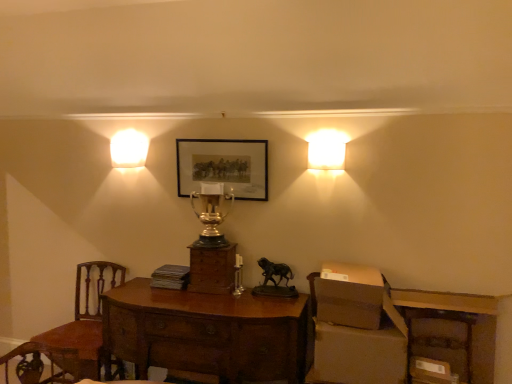
What do you see at coordinates (350, 296) in the screenshot? I see `brown cardboard box at right, which is counted as the third cardboard box, starting from the bottom` at bounding box center [350, 296].

Locate an element on the screen. The height and width of the screenshot is (384, 512). gold polished trophy at center is located at coordinates (211, 214).

The image size is (512, 384). I want to click on brown wooden desk at lower right, so coord(452,330).

This screenshot has height=384, width=512. Identify the location of matte gold trophy at upper center, placed as the 1th lamp when sorted from back to front. (129, 149).

Find the location of `desk below the brown cardboard box at lower right, which is the second cardboard box in top-to-bottom order (from the image's perspective)`. desk below the brown cardboard box at lower right, which is the second cardboard box in top-to-bottom order (from the image's perspective) is located at coordinates (206, 332).

Considering their positions, is mahogany wood desk at center located in front of or behind brown cardboard box at lower right, which is the second cardboard box in top-to-bottom order?

mahogany wood desk at center is positioned farther from the viewer than brown cardboard box at lower right, which is the second cardboard box in top-to-bottom order.

Is mahogany wood desk at center taller or shorter than brown cardboard box at lower right, placed as the 2th cardboard box when sorted from bottom to top?

Considering their sizes, mahogany wood desk at center has more height than brown cardboard box at lower right, placed as the 2th cardboard box when sorted from bottom to top.

Which of these two, mahogany wood desk at center or brown cardboard box at lower right, which is the second cardboard box in top-to-bottom order, is smaller?

brown cardboard box at lower right, which is the second cardboard box in top-to-bottom order, is smaller.

Based on their sizes in the image, would you say brown cardboard box at right, which is counted as the third cardboard box, starting from the bottom, is bigger or smaller than matte black picture frame at center?

brown cardboard box at right, which is counted as the third cardboard box, starting from the bottom, is bigger than matte black picture frame at center.

Would you say matte black picture frame at center is part of brown cardboard box at right, which is counted as the third cardboard box, starting from the bottom,'s contents?

No, matte black picture frame at center is not a part of brown cardboard box at right, which is counted as the third cardboard box, starting from the bottom.

From the picture: Considering the relative positions of brown cardboard box at right, which is counted as the third cardboard box, starting from the bottom, and matte black picture frame at center in the image provided, is brown cardboard box at right, which is counted as the third cardboard box, starting from the bottom, to the left of matte black picture frame at center from the viewer's perspective?

In fact, brown cardboard box at right, which is counted as the third cardboard box, starting from the bottom, is to the right of matte black picture frame at center.

Could you tell me if brown cardboard box at right, the 1th cardboard box when ordered from top to bottom, is facing matte black picture frame at center?

No, brown cardboard box at right, the 1th cardboard box when ordered from top to bottom, does not turn towards matte black picture frame at center.

Are brown cardboard box at lower right, placed as the 2th cardboard box when sorted from bottom to top, and gold polished trophy at center located far from each other?

That's right, there is a large distance between brown cardboard box at lower right, placed as the 2th cardboard box when sorted from bottom to top, and gold polished trophy at center.

From the image's perspective, is brown cardboard box at lower right, placed as the 2th cardboard box when sorted from bottom to top, below gold polished trophy at center?

Correct, brown cardboard box at lower right, placed as the 2th cardboard box when sorted from bottom to top, appears lower than gold polished trophy at center in the image.

Is brown cardboard box at lower right, placed as the 2th cardboard box when sorted from bottom to top, bigger than gold polished trophy at center?

Correct, brown cardboard box at lower right, placed as the 2th cardboard box when sorted from bottom to top, is larger in size than gold polished trophy at center.

Between brown cardboard box at lower right, placed as the 2th cardboard box when sorted from bottom to top, and gold polished trophy at center, which one has more height?

With more height is gold polished trophy at center.

Is brown cardboard box at lower right, acting as the first cardboard box starting from the bottom, spatially inside matte white square at upper right, marked as the 1th lamp in a right-to-left arrangement, or outside of it?

brown cardboard box at lower right, acting as the first cardboard box starting from the bottom, is spatially situated outside matte white square at upper right, marked as the 1th lamp in a right-to-left arrangement.

Considering the points (432, 365) and (324, 160), which point is in front, point (432, 365) or point (324, 160)?

Positioned in front is point (432, 365).

Is brown cardboard box at lower right, acting as the first cardboard box starting from the bottom, wider than matte white square at upper right, marked as the 1th lamp in a right-to-left arrangement?

Correct, the width of brown cardboard box at lower right, acting as the first cardboard box starting from the bottom, exceeds that of matte white square at upper right, marked as the 1th lamp in a right-to-left arrangement.

Which object is closer to the camera taking this photo, brown cardboard box at lower right, the 3th cardboard box positioned from the top, or matte white square at upper right, the 2th lamp viewed from the back?

Positioned in front is brown cardboard box at lower right, the 3th cardboard box positioned from the top.

Measure the distance from matte white square at upper right, the 1th lamp from the front, to mahogany wood chair at left.

A distance of 1.82 meters exists between matte white square at upper right, the 1th lamp from the front, and mahogany wood chair at left.

From the image's perspective, does matte white square at upper right, the 2th lamp viewed from the back, appear lower than mahogany wood chair at left?

Incorrect, from the image's perspective, matte white square at upper right, the 2th lamp viewed from the back, is higher than mahogany wood chair at left.

Based on the photo, from a real-world perspective, is matte white square at upper right, marked as the 1th lamp in a right-to-left arrangement, beneath mahogany wood chair at left?

Incorrect, from a real-world perspective, matte white square at upper right, marked as the 1th lamp in a right-to-left arrangement, is higher than mahogany wood chair at left.

Locate an element on the screen. This screenshot has width=512, height=384. chair below the matte white square at upper right, the second lamp viewed from the left (from a real-world perspective) is located at coordinates coord(87,315).

Is mahogany wood chair at left wider than brown cardboard box at lower right, acting as the first cardboard box starting from the bottom?

Correct, the width of mahogany wood chair at left exceeds that of brown cardboard box at lower right, acting as the first cardboard box starting from the bottom.

Considering the relative positions of mahogany wood chair at left and brown cardboard box at lower right, the 3th cardboard box positioned from the top, in the image provided, is mahogany wood chair at left to the right of brown cardboard box at lower right, the 3th cardboard box positioned from the top, from the viewer's perspective?

Incorrect, mahogany wood chair at left is not on the right side of brown cardboard box at lower right, the 3th cardboard box positioned from the top.

Is mahogany wood chair at left far from brown cardboard box at lower right, acting as the first cardboard box starting from the bottom?

That's right, there is a large distance between mahogany wood chair at left and brown cardboard box at lower right, acting as the first cardboard box starting from the bottom.

Can you tell me how much mahogany wood chair at left and brown cardboard box at lower right, acting as the first cardboard box starting from the bottom, differ in facing direction?

10.9 degrees.

Is brown wooden desk at lower right located within brown cardboard box at lower right, which is the second cardboard box in top-to-bottom order?

That's incorrect, brown wooden desk at lower right is not inside brown cardboard box at lower right, which is the second cardboard box in top-to-bottom order.

Which object is positioned more to the right, brown cardboard box at lower right, which is the second cardboard box in top-to-bottom order, or brown wooden desk at lower right?

From the viewer's perspective, brown wooden desk at lower right appears more on the right side.

Which is in front, brown cardboard box at lower right, placed as the 2th cardboard box when sorted from bottom to top, or brown wooden desk at lower right?

brown cardboard box at lower right, placed as the 2th cardboard box when sorted from bottom to top.

What's the angular difference between brown cardboard box at lower right, placed as the 2th cardboard box when sorted from bottom to top, and brown wooden desk at lower right's facing directions?

There is a 4.27-degree angle between the facing directions of brown cardboard box at lower right, placed as the 2th cardboard box when sorted from bottom to top, and brown wooden desk at lower right.

The height and width of the screenshot is (384, 512). In order to click on cardboard box that is the 1st one when counting forward from the mahogany wood desk at center in this screenshot , I will do pyautogui.click(x=359, y=354).

This screenshot has width=512, height=384. Find the location of `picture frame that appears behind the brown cardboard box at right, which is counted as the third cardboard box, starting from the bottom`. picture frame that appears behind the brown cardboard box at right, which is counted as the third cardboard box, starting from the bottom is located at coordinates (223, 166).

Which object lies nearer to the anchor point gold polished trophy at center, brown cardboard box at right, which is counted as the third cardboard box, starting from the bottom, or brown cardboard box at lower right, which is the second cardboard box in top-to-bottom order?

brown cardboard box at right, which is counted as the third cardboard box, starting from the bottom, is positioned closer to the anchor gold polished trophy at center.

From the image, which object appears to be farther from matte gold trophy at upper center, placed as the 2th lamp when sorted from front to back, gold polished trophy at center or brown cardboard box at right, which is counted as the third cardboard box, starting from the bottom?

brown cardboard box at right, which is counted as the third cardboard box, starting from the bottom, is positioned further to the anchor matte gold trophy at upper center, placed as the 2th lamp when sorted from front to back.

When comparing their distances from brown cardboard box at lower right, which is the second cardboard box in top-to-bottom order, does mahogany wood desk at center or matte black picture frame at center seem closer?

mahogany wood desk at center is closer to brown cardboard box at lower right, which is the second cardboard box in top-to-bottom order.

When comparing their distances from gold polished trophy at center, does matte white square at upper right, the second lamp viewed from the left, or matte gold trophy at upper center, placed as the 1th lamp when sorted from back to front, seem further?

Among the two, matte white square at upper right, the second lamp viewed from the left, is located further to gold polished trophy at center.

When comparing their distances from brown cardboard box at lower right, which is the second cardboard box in top-to-bottom order, does matte black picture frame at center or gold polished trophy at center seem closer?

Among the two, gold polished trophy at center is located nearer to brown cardboard box at lower right, which is the second cardboard box in top-to-bottom order.

When comparing their distances from matte white square at upper right, the second lamp viewed from the left, does brown cardboard box at lower right, acting as the first cardboard box starting from the bottom, or brown cardboard box at right, the 1th cardboard box when ordered from top to bottom, seem further?

brown cardboard box at lower right, acting as the first cardboard box starting from the bottom, is positioned further to the anchor matte white square at upper right, the second lamp viewed from the left.

Based on the photo, when comparing their distances from brown wooden desk at lower right, does brown cardboard box at right, the 1th cardboard box when ordered from top to bottom, or mahogany wood chair at left seem further?

The object further to brown wooden desk at lower right is mahogany wood chair at left.

Based on the photo, based on their spatial positions, is mahogany wood chair at left or mahogany wood desk at center further from brown cardboard box at lower right, placed as the 2th cardboard box when sorted from bottom to top?

The object further to brown cardboard box at lower right, placed as the 2th cardboard box when sorted from bottom to top, is mahogany wood chair at left.

Find the location of a particular element. cardboard box between matte white square at upper right, the 1th lamp from the front, and brown cardboard box at lower right, which is the second cardboard box in top-to-bottom order, from top to bottom is located at coordinates (x=350, y=296).

Where is `picture frame between mahogany wood chair at left and brown wooden desk at lower right`? picture frame between mahogany wood chair at left and brown wooden desk at lower right is located at coordinates (223, 166).

In order to click on picture frame between gold polished trophy at center and brown wooden desk at lower right in this screenshot , I will do `click(223, 166)`.

Find the location of a particular element. Image resolution: width=512 pixels, height=384 pixels. picture frame between matte gold trophy at upper center, the 1th lamp positioned from the left, and brown cardboard box at right, the 1th cardboard box when ordered from top to bottom, from left to right is located at coordinates (223, 166).